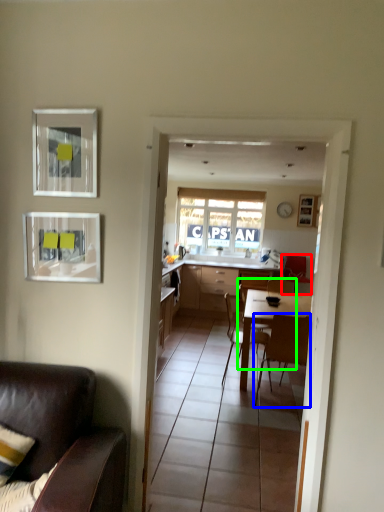
Question: Which is farther away from chair (highlighted by a red box)? chair (highlighted by a blue box) or chair (highlighted by a green box)?

Choices:
 (A) chair
 (B) chair

Answer: (A)